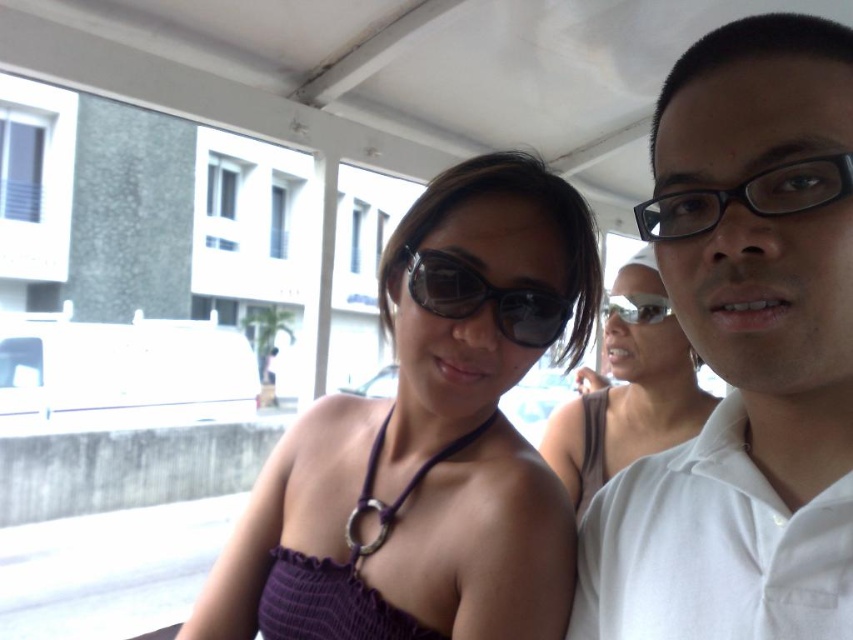
You are a photographer trying to capture the perfect shot of the matte purple dress at center and the transparent plastic goggles at upper center. Based on their positions, which object should you focus on first if you want to ensure both are in the frame without moving the camera?

The matte purple dress at center is located below the transparent plastic goggles at upper center, so you should focus on the transparent plastic goggles at upper center first to ensure both are in the frame without moving the camera.

You are standing in front of the image and want to locate the purple fabric dress at center. Can you tell me its exact position in terms of coordinates?

The purple fabric dress at center is located at coordinates point [428,440].